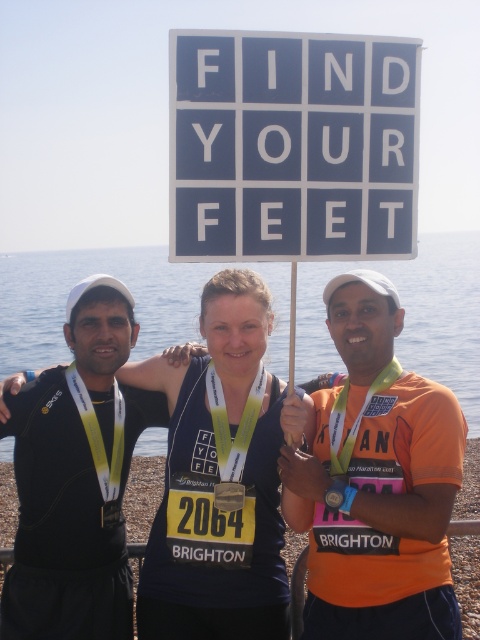
Which is above, orange fabric shirt at center or shiny blue tank top at center?

orange fabric shirt at center

Who is lower down, orange fabric shirt at center or shiny blue tank top at center?

shiny blue tank top at center is below.

You are a GUI agent. You are given a task and a screenshot of the screen. Output one action in this format:
    pyautogui.click(x=<x>, y=<y>)
    Task: Click on the orange fabric shirt at center
    
    Given the screenshot: What is the action you would take?
    pyautogui.click(x=376, y=481)

Image resolution: width=480 pixels, height=640 pixels. What do you see at coordinates (292, 147) in the screenshot?
I see `white plastic sign at upper center` at bounding box center [292, 147].

Locate an element on the screen. This screenshot has height=640, width=480. white plastic sign at upper center is located at coordinates (292, 147).

Who is more forward, [227,129] or [183,484]?

Point [227,129]

Which is more to the right, white plastic sign at upper center or shiny blue tank top at center?

white plastic sign at upper center

Is point (384, 176) in front of point (163, 381)?

That is True.

Identify the location of white plastic sign at upper center. The width and height of the screenshot is (480, 640). (292, 147).